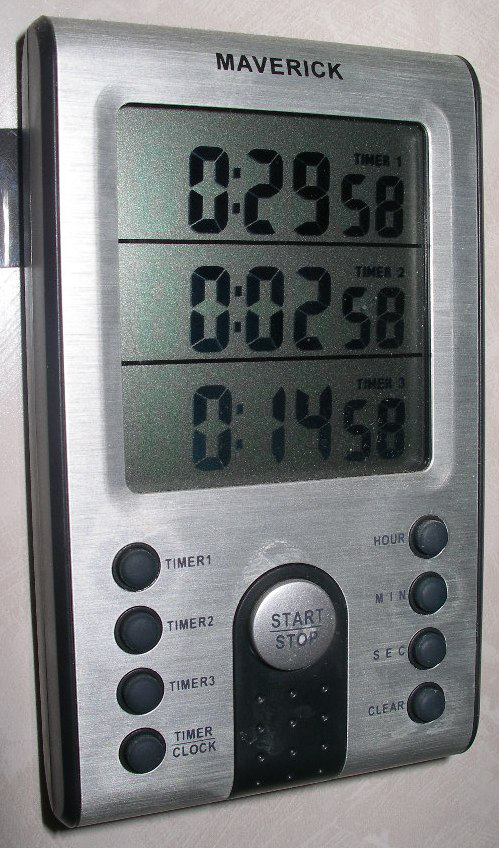
You are a GUI agent. You are given a task and a screenshot of the screen. Output one action in this format:
    pyautogui.click(x=<x>, y=<y>)
    Task: Click on the wall
    Image resolution: width=499 pixels, height=848 pixels.
    Given the screenshot: What is the action you would take?
    pyautogui.click(x=389, y=23)